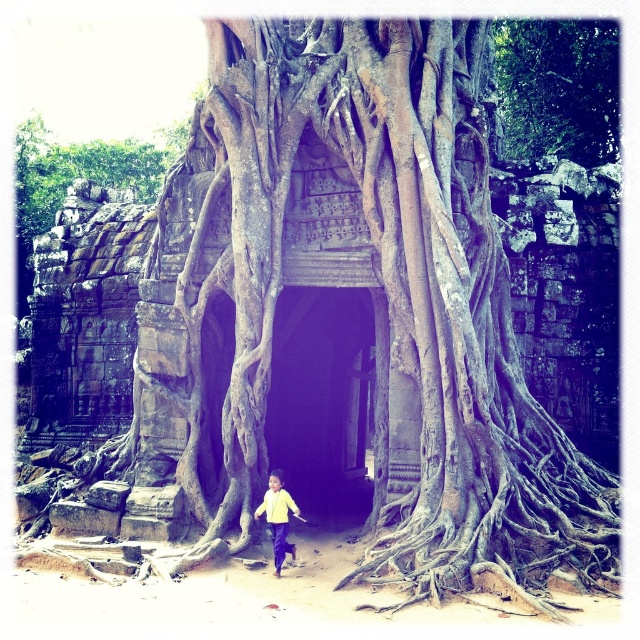
Question: Does green leafy tree at upper center appear on the right side of brown rough tree roots at center?

Choices:
 (A) no
 (B) yes

Answer: (B)

Question: Does brown rough textured banyan tree at center appear on the left side of dark stone archway at center?

Choices:
 (A) yes
 (B) no

Answer: (B)

Question: Estimate the real-world distances between objects in this image. Which object is closer to the brown rough tree roots at center?

Choices:
 (A) yellow matte shirt at center
 (B) green leafy tree at upper center
 (C) dark stone archway at center
 (D) brown rough textured banyan tree at center

Answer: (C)

Question: Is dark stone archway at center below green leafy tree at upper center?

Choices:
 (A) no
 (B) yes

Answer: (B)

Question: Which point is closer to the camera taking this photo?

Choices:
 (A) (513, 45)
 (B) (273, 544)
 (C) (344, 372)
 (D) (483, 346)

Answer: (B)

Question: Which point is closer to the camera?

Choices:
 (A) brown rough textured banyan tree at center
 (B) brown rough tree roots at center

Answer: (A)